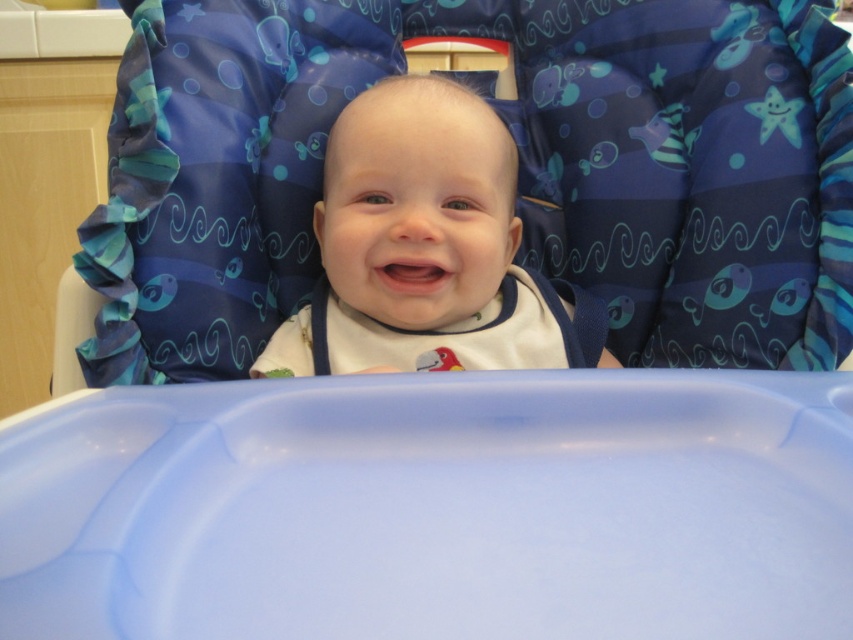
Does white soft baby at center have a smaller size compared to white fabric bib at center?

Incorrect, white soft baby at center is not smaller in size than white fabric bib at center.

Is point (465, 292) positioned before point (428, 339)?

That is True.

What are the coordinates of `white soft baby at center` in the screenshot? It's located at (426, 248).

Can you confirm if blue fabric feeding chair at upper center is positioned below white soft baby at center?

Incorrect, blue fabric feeding chair at upper center is not positioned below white soft baby at center.

Who is shorter, blue fabric feeding chair at upper center or white soft baby at center?

With less height is white soft baby at center.

Does point (540, 129) lie in front of point (457, 147)?

No, (540, 129) is behind (457, 147).

I want to click on blue fabric feeding chair at upper center, so click(x=519, y=172).

Based on the photo, which is below, blue fabric feeding chair at upper center or white fabric bib at center?

white fabric bib at center

Does blue fabric feeding chair at upper center appear under white fabric bib at center?

Actually, blue fabric feeding chair at upper center is above white fabric bib at center.

You are a GUI agent. You are given a task and a screenshot of the screen. Output one action in this format:
    pyautogui.click(x=<x>, y=<y>)
    Task: Click on the blue fabric feeding chair at upper center
    
    Given the screenshot: What is the action you would take?
    pyautogui.click(x=519, y=172)